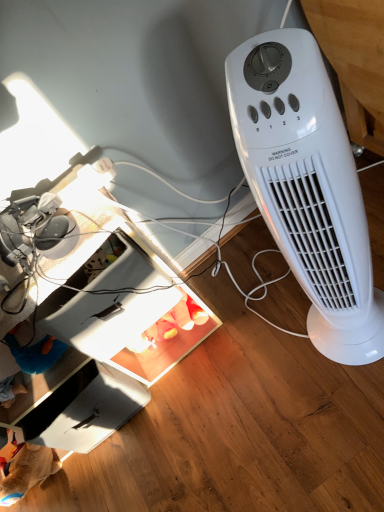
Question: Is white cardboard drawer at lower left facing towards white plastic heater at right?

Choices:
 (A) yes
 (B) no

Answer: (B)

Question: Does white cardboard drawer at lower left have a smaller size compared to white plastic heater at right?

Choices:
 (A) yes
 (B) no

Answer: (A)

Question: Can you confirm if white cardboard drawer at lower left is taller than white plastic heater at right?

Choices:
 (A) no
 (B) yes

Answer: (A)

Question: From a real-world perspective, is white cardboard drawer at lower left on top of white plastic heater at right?

Choices:
 (A) yes
 (B) no

Answer: (B)

Question: Considering the relative sizes of white cardboard drawer at lower left and white plastic heater at right in the image provided, is white cardboard drawer at lower left thinner than white plastic heater at right?

Choices:
 (A) yes
 (B) no

Answer: (B)

Question: Does white cardboard drawer at lower left have a larger size compared to white plastic heater at right?

Choices:
 (A) yes
 (B) no

Answer: (B)

Question: From a real-world perspective, is white plastic computer desk at lower left positioned over white plastic heater at right based on gravity?

Choices:
 (A) yes
 (B) no

Answer: (B)

Question: Is white plastic computer desk at lower left taller than white plastic heater at right?

Choices:
 (A) yes
 (B) no

Answer: (B)

Question: From the image's perspective, is white plastic computer desk at lower left under white plastic heater at right?

Choices:
 (A) no
 (B) yes

Answer: (B)

Question: Is white plastic computer desk at lower left at the right side of white plastic heater at right?

Choices:
 (A) no
 (B) yes

Answer: (A)

Question: Can you confirm if white plastic computer desk at lower left is smaller than white plastic heater at right?

Choices:
 (A) no
 (B) yes

Answer: (A)

Question: Could you tell me if white plastic computer desk at lower left is facing white plastic heater at right?

Choices:
 (A) no
 (B) yes

Answer: (A)

Question: From a real-world perspective, is white plastic heater at right positioned under white cardboard drawer at lower left based on gravity?

Choices:
 (A) yes
 (B) no

Answer: (B)